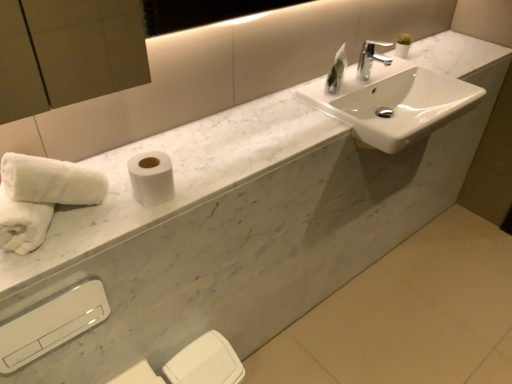
Where is `free space behind white matte toilet paper at center, positioned as the 1th toilet paper in front-to-back order`? The height and width of the screenshot is (384, 512). free space behind white matte toilet paper at center, positioned as the 1th toilet paper in front-to-back order is located at coordinates (182, 151).